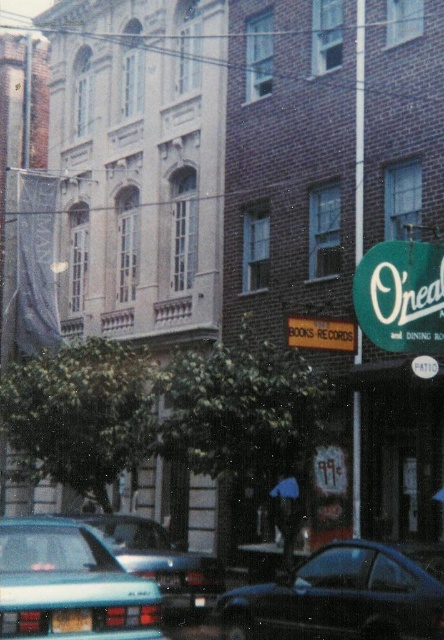
You are a delivery driver who needs to park your teal matte car at lower left in a spot that can accommodate its size. There is a parking space near the matte black sign at center. Can your car fit in that space based on their sizes?

The teal matte car at lower left is larger than the matte black sign at center, so it may not fit in the parking space near the matte black sign at center unless the space is appropriately sized for larger vehicles.

You are standing in front of the two buildings and want to take a photo that includes both points, point [440,282] and point [191,596]. Which point is closer to your camera when you take the photo?

Point [191,596] is closer to the camera because it is less further than point [440,282].

You are a delivery person trying to park your teal matte car at lower left near the green fabric sign at lower right. Can you fit your car next to the sign without overlapping?

The green fabric sign at lower right occupies less space than the teal matte car at lower left, so there is enough space to park the teal matte car at lower left next to the green fabric sign at lower right without overlapping.